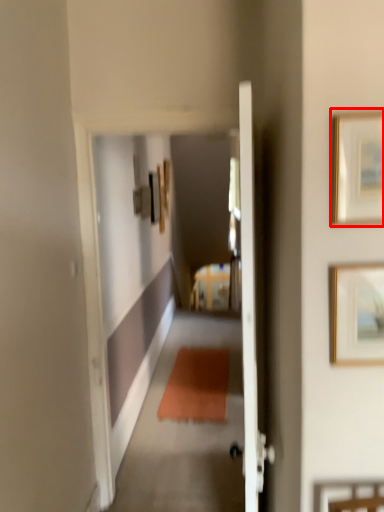
Question: From the image's perspective, what is the correct spatial positioning of picture frame (annotated by the red box) in reference to picture frame?

Choices:
 (A) above
 (B) below

Answer: (A)